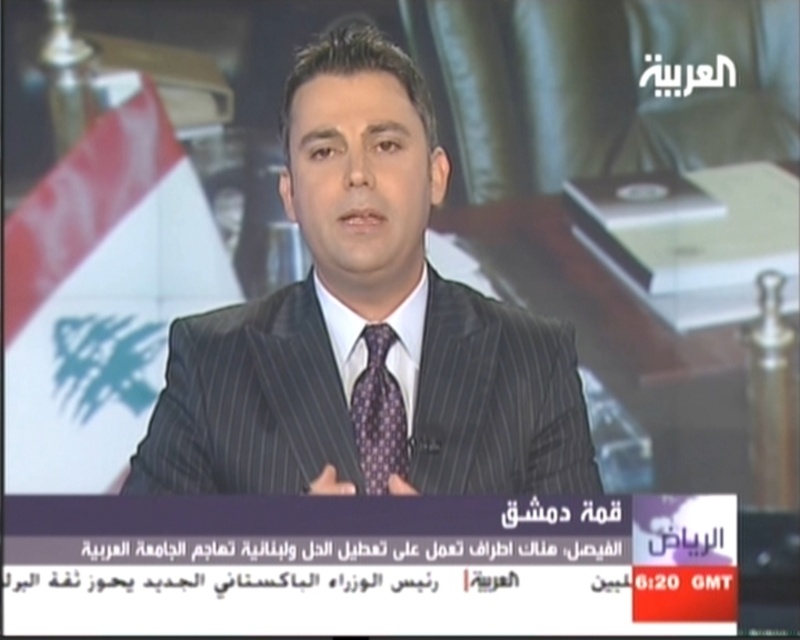
Question: Is matte black suit at center bigger than purple printed tie at center?

Choices:
 (A) no
 (B) yes

Answer: (B)

Question: Which object is farther from the camera taking this photo?

Choices:
 (A) purple printed tie at center
 (B) matte black suit at center

Answer: (A)

Question: Is matte black suit at center smaller than purple printed tie at center?

Choices:
 (A) yes
 (B) no

Answer: (B)

Question: Which point is closer to the camera?

Choices:
 (A) purple printed tie at center
 (B) matte black suit at center

Answer: (B)

Question: Does matte black suit at center have a greater width compared to purple printed tie at center?

Choices:
 (A) yes
 (B) no

Answer: (A)

Question: Which point appears farthest from the camera in this image?

Choices:
 (A) (352, 134)
 (B) (376, 387)

Answer: (B)